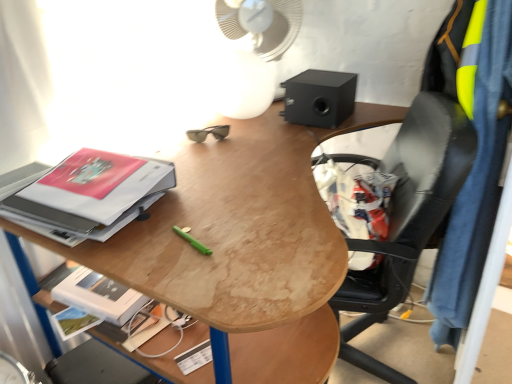
You are a GUI agent. You are given a task and a screenshot of the screen. Output one action in this format:
    pyautogui.click(x=<x>, y=<y>)
    Task: Click on the wooden desk at center
    Image resolution: width=512 pixels, height=384 pixels.
    Given the screenshot: What is the action you would take?
    pyautogui.click(x=243, y=247)

What do you see at coordinates (256, 50) in the screenshot?
I see `white plastic mechanical fan at upper center` at bounding box center [256, 50].

You are a GUI agent. You are given a task and a screenshot of the screen. Output one action in this format:
    pyautogui.click(x=<x>, y=<y>)
    Task: Click on the wooden desk at center
    The width and height of the screenshot is (512, 384).
    Given the screenshot: What is the action you would take?
    pyautogui.click(x=243, y=247)

Considering the sizes of objects white plastic mechanical fan at upper center and wooden desk at center in the image provided, who is taller, white plastic mechanical fan at upper center or wooden desk at center?

With more height is wooden desk at center.

Does point (263, 106) come behind point (311, 374)?

Yes, it is.

At what (x,y) coordinates should I click in order to perform the action: click on mechanical fan behind the wooden desk at center. Please return your answer as a coordinate pair (x, y). The height and width of the screenshot is (384, 512). Looking at the image, I should click on (256, 50).

Can you confirm if neon yellow fabric at right is smaller than matte hardcover book at left?

No.

Based on the photo, does neon yellow fabric at right turn towards matte hardcover book at left?

No.

Which of these two, neon yellow fabric at right or matte hardcover book at left, stands shorter?

With less height is matte hardcover book at left.

From the picture: What's the angular difference between wooden desk at center and neon yellow fabric at right's facing directions?

They differ by 159 degrees in their facing directions.

In the image, there is a neon yellow fabric at right. At what (x,y) coordinates should I click in order to perform the action: click on desk below it (from the image's perspective). Please return your answer as a coordinate pair (x, y). Looking at the image, I should click on (243, 247).

From a real-world perspective, is wooden desk at center positioned above or below neon yellow fabric at right?

Clearly, from a real-world perspective, wooden desk at center is below neon yellow fabric at right.

From the image's perspective, is matte hardcover book at left located above or below neon yellow fabric at right?

matte hardcover book at left is above neon yellow fabric at right.

Is matte hardcover book at left next to neon yellow fabric at right?

There is a gap between matte hardcover book at left and neon yellow fabric at right.

Can you confirm if matte hardcover book at left is thinner than neon yellow fabric at right?

In fact, matte hardcover book at left might be wider than neon yellow fabric at right.

Looking at this image, do you think wooden desk at center is within white plastic mechanical fan at upper center, or outside of it?

wooden desk at center lies outside white plastic mechanical fan at upper center.

From the image's perspective, would you say wooden desk at center is positioned over white plastic mechanical fan at upper center?

No, from the image's perspective, wooden desk at center is not on top of white plastic mechanical fan at upper center.

Is there a large distance between wooden desk at center and white plastic mechanical fan at upper center?

No, wooden desk at center is in close proximity to white plastic mechanical fan at upper center.

Does point (264, 207) come closer to viewer compared to point (269, 17)?

Yes, it is in front of point (269, 17).

Can you confirm if black matte speaker at upper right is thinner than wooden desk at center?

Indeed, black matte speaker at upper right has a lesser width compared to wooden desk at center.

Where is `desk below the black matte speaker at upper right (from a real-world perspective)`? desk below the black matte speaker at upper right (from a real-world perspective) is located at coordinates (243, 247).

Is wooden desk at center located within black matte speaker at upper right?

Actually, wooden desk at center is outside black matte speaker at upper right.

From a real-world perspective, does black matte speaker at upper right sit lower than wooden desk at center?

No, from a real-world perspective, black matte speaker at upper right is not under wooden desk at center.

Does point (313, 101) come in front of point (71, 208)?

No, it is not.

Is matte hardcover book at left completely or partially inside black matte speaker at upper right?

No, matte hardcover book at left is not surrounded by black matte speaker at upper right.

Who is smaller, black matte speaker at upper right or matte hardcover book at left?

black matte speaker at upper right is smaller.

Between black matte speaker at upper right and matte hardcover book at left, which one has larger width?

With larger width is matte hardcover book at left.

Identify the location of mechanical fan located on the left of wooden desk at center. The image size is (512, 384). (256, 50).

Identify the location of paperback book located in front of the neon yellow fabric at right. This screenshot has width=512, height=384. (92, 193).

Estimate the real-world distances between objects in this image. Which object is further from matte hardcover book at left, black matte speaker at upper right or neon yellow fabric at right?

neon yellow fabric at right.

Considering their positions, is white plastic mechanical fan at upper center positioned further to neon yellow fabric at right than wooden desk at center?

white plastic mechanical fan at upper center is positioned further to the anchor neon yellow fabric at right.

Looking at the image, which one is located closer to white plastic mechanical fan at upper center, black matte speaker at upper right or wooden desk at center?

black matte speaker at upper right lies closer to white plastic mechanical fan at upper center than the other object.

Looking at this image, which object lies further to the anchor point matte hardcover book at left, black matte speaker at upper right or wooden desk at center?

black matte speaker at upper right is further to matte hardcover book at left.

When comparing their distances from black matte speaker at upper right, does matte hardcover book at left or white plastic mechanical fan at upper center seem closer?

white plastic mechanical fan at upper center lies closer to black matte speaker at upper right than the other object.

Considering their positions, is black matte speaker at upper right positioned closer to neon yellow fabric at right than wooden desk at center?

black matte speaker at upper right lies closer to neon yellow fabric at right than the other object.

Estimate the real-world distances between objects in this image. Which object is further from neon yellow fabric at right, matte hardcover book at left or white plastic mechanical fan at upper center?

matte hardcover book at left is positioned further to the anchor neon yellow fabric at right.

Looking at the image, which one is located closer to wooden desk at center, matte hardcover book at left or white plastic mechanical fan at upper center?

Among the two, matte hardcover book at left is located nearer to wooden desk at center.

The image size is (512, 384). Identify the location of clothing between wooden desk at center and black matte speaker at upper right in the front-back direction. (475, 174).

This screenshot has height=384, width=512. What are the coordinates of `desk between matte hardcover book at left and neon yellow fabric at right in the horizontal direction` in the screenshot? It's located at (243, 247).

You are a GUI agent. You are given a task and a screenshot of the screen. Output one action in this format:
    pyautogui.click(x=<x>, y=<y>)
    Task: Click on the clothing between wooden desk at center and white plastic mechanical fan at upper center along the z-axis
    
    Given the screenshot: What is the action you would take?
    pyautogui.click(x=475, y=174)

This screenshot has height=384, width=512. In order to click on loudspeaker between neon yellow fabric at right and white plastic mechanical fan at upper center along the z-axis in this screenshot , I will do tap(319, 98).